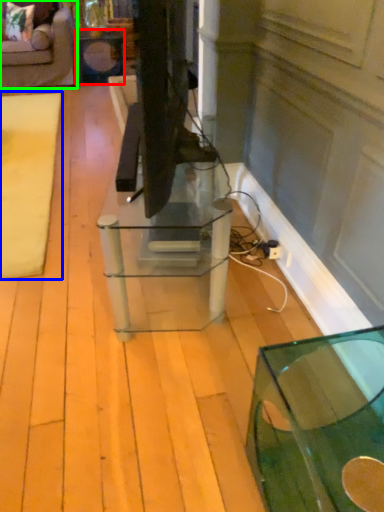
Question: Estimate the real-world distances between objects in this image. Which object is farther from side table (highlighted by a red box), mat (highlighted by a blue box) or furniture (highlighted by a green box)?

Choices:
 (A) mat
 (B) furniture

Answer: (A)